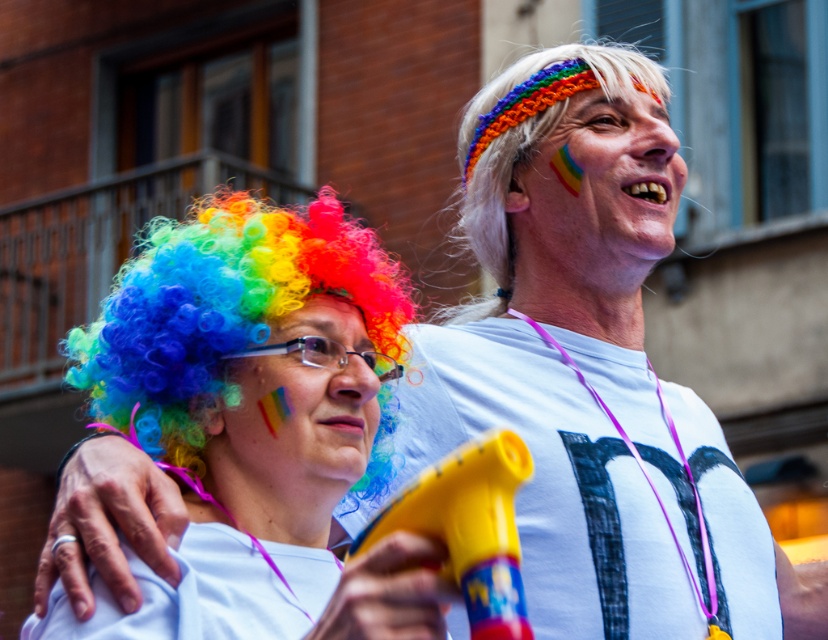
I want to click on rainbow wig at left, so click(263, 381).

In the scene shown: Can you confirm if rainbow wig at left is thinner than rainbow fabric headband at upper center?

Incorrect, rainbow wig at left's width is not less than rainbow fabric headband at upper center's.

Which is behind, point (402, 586) or point (581, 184)?

The point (581, 184) is more distant.

Where is `rainbow wig at left`? The width and height of the screenshot is (828, 640). rainbow wig at left is located at coordinates (263, 381).

Consider the image. How far apart are rainbow wig at left and rainbow wig at center?

rainbow wig at left and rainbow wig at center are 29.99 inches apart from each other.

Who is more forward, (114, 422) or (304, 428)?

Point (304, 428) is in front.

Which is behind, point (239, 508) or point (225, 467)?

The point (225, 467) is more distant.

Identify the location of rainbow wig at left. (263, 381).

You are a GUI agent. You are given a task and a screenshot of the screen. Output one action in this format:
    pyautogui.click(x=<x>, y=<y>)
    Task: Click on the rainbow wig at left
    This screenshot has width=828, height=640.
    Given the screenshot: What is the action you would take?
    pyautogui.click(x=263, y=381)

Does point (292, 547) lie in front of point (644, 84)?

Yes, it is.

At what (x,y) coordinates should I click in order to perform the action: click on rainbow wig at left. Please return your answer as a coordinate pair (x, y). Looking at the image, I should click on (263, 381).

You are a GUI agent. You are given a task and a screenshot of the screen. Output one action in this format:
    pyautogui.click(x=<x>, y=<y>)
    Task: Click on the rainbow wig at left
    
    Given the screenshot: What is the action you would take?
    pyautogui.click(x=263, y=381)